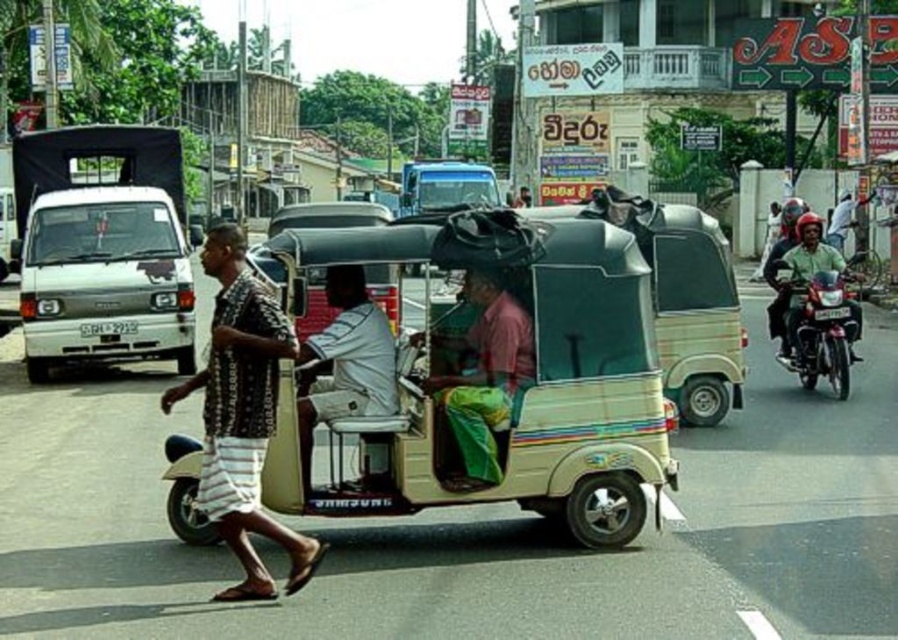
You are a delivery person needing to pass between the pink fabric shirt at center and the shiny metallic motorcycle at right. Given that your delivery box is 30 cm thick, can you fit through the space between them?

The pink fabric shirt at center is thinner than the shiny metallic motorcycle at right, but without knowing the exact width of the space between them, it is impossible to determine if the 30 cm thick delivery box can fit through. Additional measurements are needed.

You are a photographer standing at the camera position. You want to take a clear photo of the pink fabric shirt at center. What is the minimum distance you need to move forward or backward to ensure the shirt is in focus? The camera has a depth of field that can only focus on objects within 20 feet from the camera.

The pink fabric shirt at center is currently 22.03 feet away from the camera. To bring it within the 20 feet focus range, you need to move forward approximately 2.03 feet closer to the shirt.

You are a delivery person who needs to park your beige plastic tricycle at center and shiny metallic motorcycle at right side by side in a narrow alley. Based on the scene, which vehicle should be parked first to ensure both can fit?

The beige plastic tricycle at center is wider than the shiny metallic motorcycle at right, so you should park the narrower shiny metallic motorcycle at right first to allow space for the wider beige plastic tricycle at center.